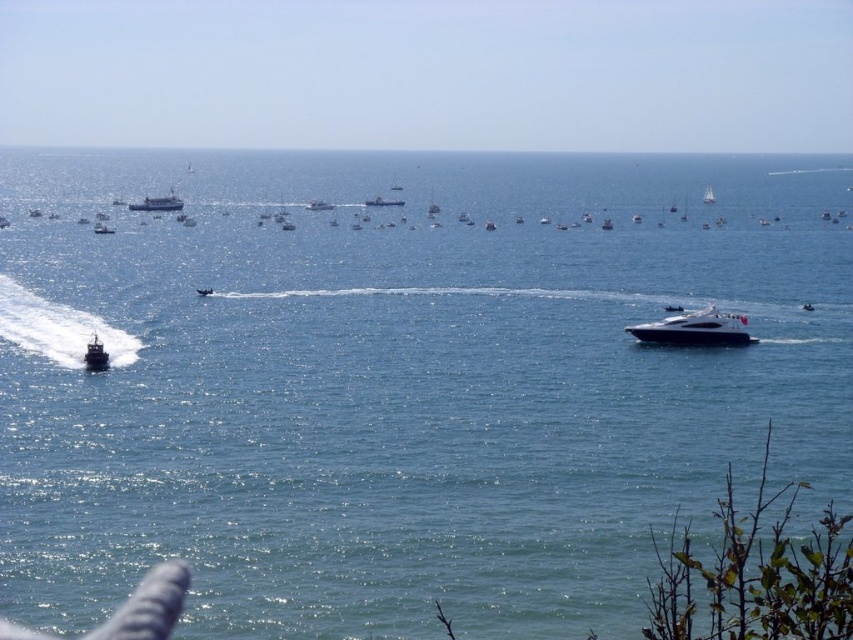
Which is behind, point (387, 205) or point (318, 205)?

Positioned behind is point (387, 205).

Is metallic silver boat at center below metallic silver yacht at center?

No, metallic silver boat at center is not below metallic silver yacht at center.

Does point (401, 198) lie behind point (331, 209)?

Yes, it is.

Identify the location of metallic silver boat at center. The image size is (853, 640). (383, 202).

Does metallic silver boat at center have a lesser height compared to white glossy sailboat at upper center?

Yes, metallic silver boat at center is shorter than white glossy sailboat at upper center.

Can you confirm if metallic silver boat at center is thinner than white glossy sailboat at upper center?

Yes.

Who is more forward, (370, 198) or (706, 189)?

Point (370, 198)

Where is `metallic silver boat at center`? Image resolution: width=853 pixels, height=640 pixels. metallic silver boat at center is located at coordinates (383, 202).

In the scene shown: Is white matte ship at upper center bigger than metallic silver yacht at center?

Indeed, white matte ship at upper center has a larger size compared to metallic silver yacht at center.

Does white matte ship at upper center appear over metallic silver yacht at center?

Indeed, white matte ship at upper center is positioned over metallic silver yacht at center.

Does point (152, 211) come farther from viewer compared to point (326, 202)?

No.

At what (x,y) coordinates should I click in order to perform the action: click on white matte ship at upper center. Please return your answer as a coordinate pair (x, y). This screenshot has height=640, width=853. Looking at the image, I should click on (158, 204).